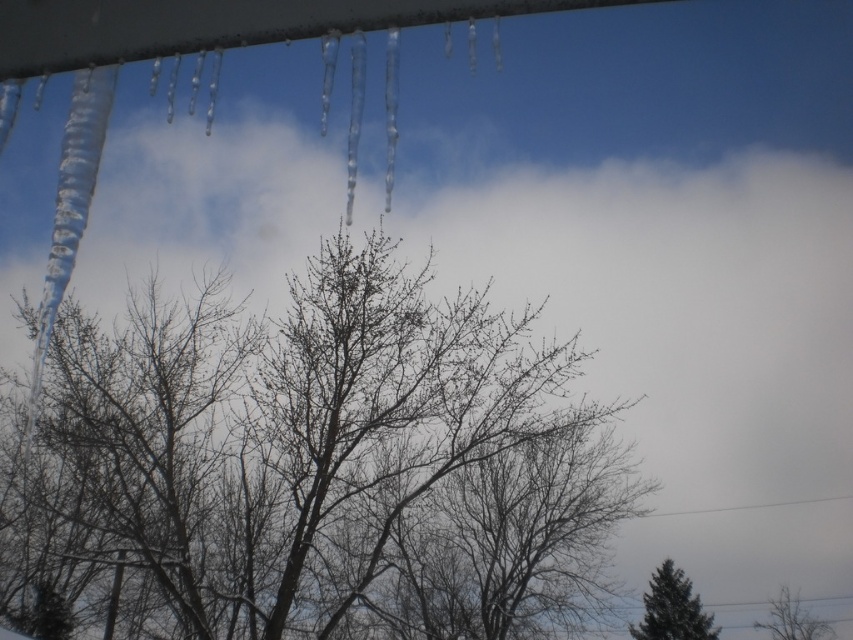
You are standing in the winter scene and see the point at coordinates (311, 468). Based on the description, what is located at that point?

The point at coordinates (311, 468) is located on the bare branches at center.

You are a bird looking for a place to perch. You can see the bare branches at center and the green matte tree at lower right. Which one is closer to you?

The bare branches at center are closer to you than the green matte tree at lower right since they are 5.27 meters apart.